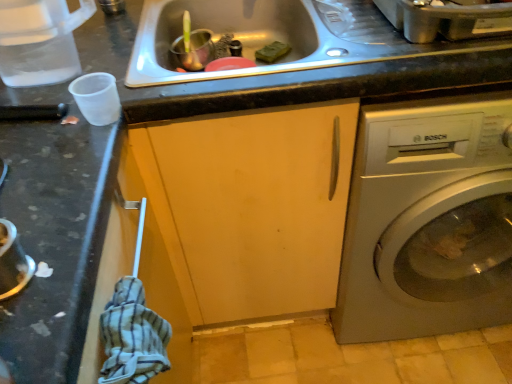
What is the approximate height of satin silver washing machine at right?

86.60 centimeters.

What do you see at coordinates (428, 220) in the screenshot? This screenshot has width=512, height=384. I see `satin silver washing machine at right` at bounding box center [428, 220].

This screenshot has width=512, height=384. Find the location of `matte wood cabinet at center`. matte wood cabinet at center is located at coordinates (251, 206).

Describe the element at coordinates (39, 41) in the screenshot. I see `transparent plastic cup at left` at that location.

The width and height of the screenshot is (512, 384). Identify the location of satin silver washing machine at right. (428, 220).

From the image's perspective, between transparent plastic cup at left and stainless steel sink at center, which one is located above?

stainless steel sink at center appears higher in the image.

From a real-world perspective, is transparent plastic cup at left positioned over stainless steel sink at center based on gravity?

Yes, from a real-world perspective, transparent plastic cup at left is over stainless steel sink at center

Considering the relative positions of transparent plastic cup at left and stainless steel sink at center in the image provided, is transparent plastic cup at left in front of stainless steel sink at center?

Yes, transparent plastic cup at left is closer to the camera.

Which is behind, point (13, 60) or point (152, 11)?

The point (152, 11) is farther from the camera.

Which of these two, matte wood cabinet at center or satin silver washing machine at right, is thinner?

matte wood cabinet at center.

Considering the relative positions of matte wood cabinet at center and satin silver washing machine at right in the image provided, is matte wood cabinet at center in front of satin silver washing machine at right?

No.

Considering the points (202, 120) and (424, 292), which point is in front, point (202, 120) or point (424, 292)?

The point (202, 120) is closer.

Is stainless steel sink at center positioned far away from satin silver washing machine at right?

No, stainless steel sink at center is not far away from satin silver washing machine at right.

Is stainless steel sink at center thinner than satin silver washing machine at right?

Yes, stainless steel sink at center is thinner than satin silver washing machine at right.

Between stainless steel sink at center and satin silver washing machine at right, which one is positioned in front?

Positioned in front is satin silver washing machine at right.

Which point is more forward, (167, 4) or (426, 272)?

The point (167, 4) is closer.

Identify the location of cabinetry that appears in front of the stainless steel sink at center. (251, 206).

Considering their positions, is matte wood cabinet at center located in front of or behind stainless steel sink at center?

Visually, matte wood cabinet at center is located in front of stainless steel sink at center.

Between matte wood cabinet at center and stainless steel sink at center, which one has smaller size?

Smaller between the two is stainless steel sink at center.

Which object is more forward, satin silver washing machine at right or matte wood cabinet at center?

satin silver washing machine at right is in front.

In the scene shown: From the image's perspective, does satin silver washing machine at right appear lower than matte wood cabinet at center?

No, from the image's perspective, satin silver washing machine at right is not below matte wood cabinet at center.

Is satin silver washing machine at right spatially inside matte wood cabinet at center, or outside of it?

The correct answer is: outside.

Looking at this image, which is less distant, (404,149) or (177,279)?

Point (404,149) is closer to the camera than point (177,279).

The image size is (512, 384). In order to click on washing machine below the transparent plastic cup at left (from the image's perspective) in this screenshot , I will do `click(428, 220)`.

Is satin silver washing machine at right outside of transparent plastic cup at left?

satin silver washing machine at right is positioned outside transparent plastic cup at left.

Could you tell me if satin silver washing machine at right is facing transparent plastic cup at left?

No, satin silver washing machine at right is not turned towards transparent plastic cup at left.

Is satin silver washing machine at right facing away from stainless steel sink at center?

No.

Which is in front, point (475, 153) or point (195, 81)?

The point (195, 81) is closer.

Is satin silver washing machine at right bigger or smaller than stainless steel sink at center?

satin silver washing machine at right is bigger than stainless steel sink at center.

Which object is closer to the camera taking this photo, satin silver washing machine at right or stainless steel sink at center?

Positioned in front is satin silver washing machine at right.

In order to click on sink below the transparent plastic cup at left (from a real-world perspective) in this screenshot , I will do `click(279, 36)`.

Find the location of a particular element. The width and height of the screenshot is (512, 384). cabinetry above the satin silver washing machine at right (from a real-world perspective) is located at coordinates (251, 206).

From the picture: Based on their spatial positions, is satin silver washing machine at right or matte wood cabinet at center further from transparent plastic cup at left?

The object further to transparent plastic cup at left is satin silver washing machine at right.

When comparing their distances from satin silver washing machine at right, does matte wood cabinet at center or stainless steel sink at center seem further?

stainless steel sink at center is further to satin silver washing machine at right.

Considering their positions, is transparent plastic cup at left positioned further to matte wood cabinet at center than stainless steel sink at center?

transparent plastic cup at left is positioned further to the anchor matte wood cabinet at center.

Based on their spatial positions, is transparent plastic cup at left or matte wood cabinet at center closer to satin silver washing machine at right?

matte wood cabinet at center is positioned closer to the anchor satin silver washing machine at right.

Consider the image. When comparing their distances from transparent plastic cup at left, does satin silver washing machine at right or stainless steel sink at center seem further?

satin silver washing machine at right lies further to transparent plastic cup at left than the other object.

Which object lies nearer to the anchor point matte wood cabinet at center, satin silver washing machine at right or stainless steel sink at center?

satin silver washing machine at right is closer to matte wood cabinet at center.

Which object lies further to the anchor point satin silver washing machine at right, stainless steel sink at center or matte wood cabinet at center?

stainless steel sink at center.

Estimate the real-world distances between objects in this image. Which object is closer to matte wood cabinet at center, transparent plastic cup at left or satin silver washing machine at right?

The object closer to matte wood cabinet at center is satin silver washing machine at right.

The image size is (512, 384). What are the coordinates of `cabinetry situated between transparent plastic cup at left and stainless steel sink at center from left to right` in the screenshot? It's located at (251, 206).

This screenshot has width=512, height=384. Find the location of `sink between transparent plastic cup at left and satin silver washing machine at right`. sink between transparent plastic cup at left and satin silver washing machine at right is located at coordinates (279, 36).

Find the location of a particular element. Image resolution: width=512 pixels, height=384 pixels. cabinetry between transparent plastic cup at left and satin silver washing machine at right is located at coordinates (251, 206).

Identify the location of sink situated between matte wood cabinet at center and satin silver washing machine at right from left to right. (279, 36).